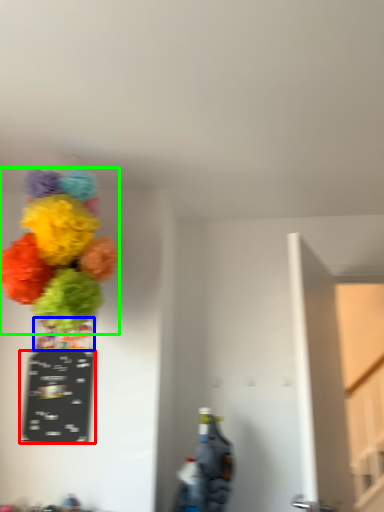
Question: Considering the real-world distances, which object is closest to writing (highlighted by a red box)? vase (highlighted by a blue box) or flower (highlighted by a green box).

Choices:
 (A) vase
 (B) flower

Answer: (A)